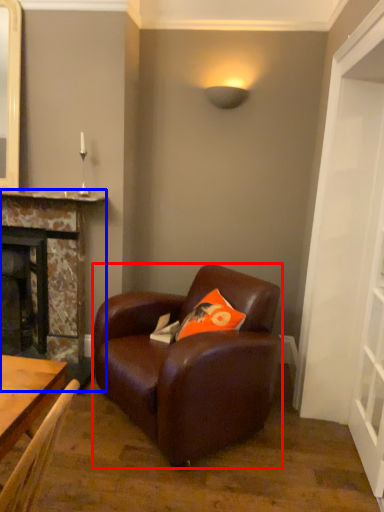
Question: Which point is closer to the camera, chair (highlighted by a red box) or fireplace (highlighted by a blue box)?

Choices:
 (A) chair
 (B) fireplace

Answer: (A)